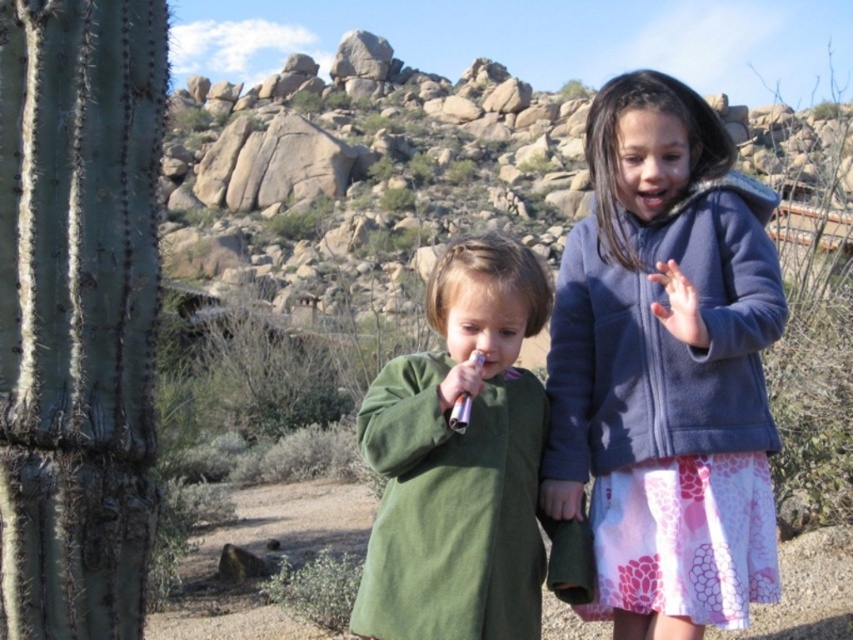
Question: Can you confirm if blue fleece jacket at center is smaller than green fleece jacket at center?

Choices:
 (A) yes
 (B) no

Answer: (B)

Question: Is blue fleece jacket at center above green fleece jacket at center?

Choices:
 (A) yes
 (B) no

Answer: (A)

Question: Can you confirm if blue fleece jacket at center is wider than green fleece jacket at center?

Choices:
 (A) yes
 (B) no

Answer: (A)

Question: Which point is farther from the camera taking this photo?

Choices:
 (A) (514, 369)
 (B) (663, 202)

Answer: (A)